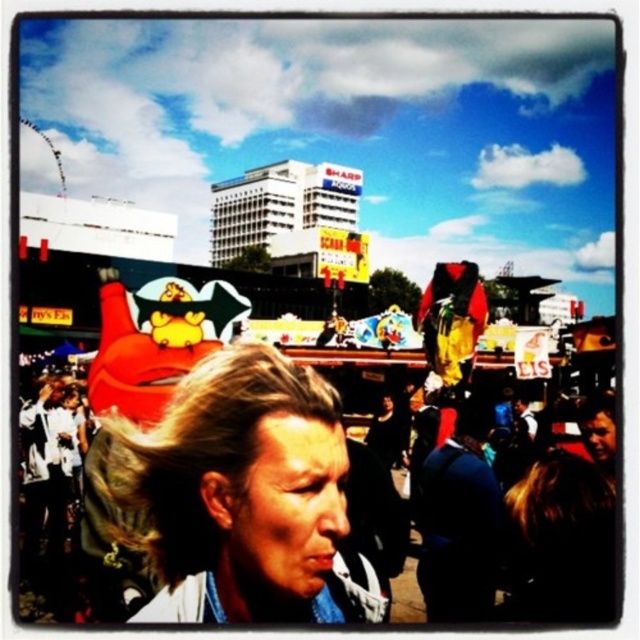
Question: In this image, where is blonde hair at center located relative to blue fabric jacket at center?

Choices:
 (A) left
 (B) right

Answer: (A)

Question: Considering the real-world distances, which object is closest to the white fabric at center?

Choices:
 (A) blue fabric jacket at center
 (B) blonde hair at center

Answer: (B)

Question: Which point is farther to the camera?

Choices:
 (A) blonde hair at center
 (B) blue fabric jacket at center
 (C) white fabric at center

Answer: (B)

Question: Is the position of white fabric at center less distant than that of blonde hair at center?

Choices:
 (A) yes
 (B) no

Answer: (B)

Question: Which object is farther from the camera taking this photo?

Choices:
 (A) blue fabric jacket at center
 (B) blonde hair at center
 (C) white fabric at center

Answer: (A)

Question: Does blonde hair at center come behind blue fabric jacket at center?

Choices:
 (A) yes
 (B) no

Answer: (B)